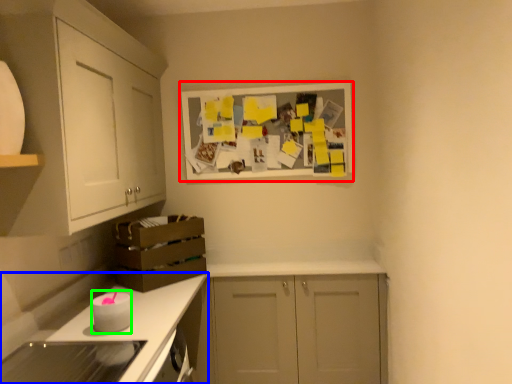
Question: Considering the real-world distances, which object is closest to picture frame (highlighted by a red box)? countertop (highlighted by a blue box) or appliance (highlighted by a green box).

Choices:
 (A) countertop
 (B) appliance

Answer: (A)